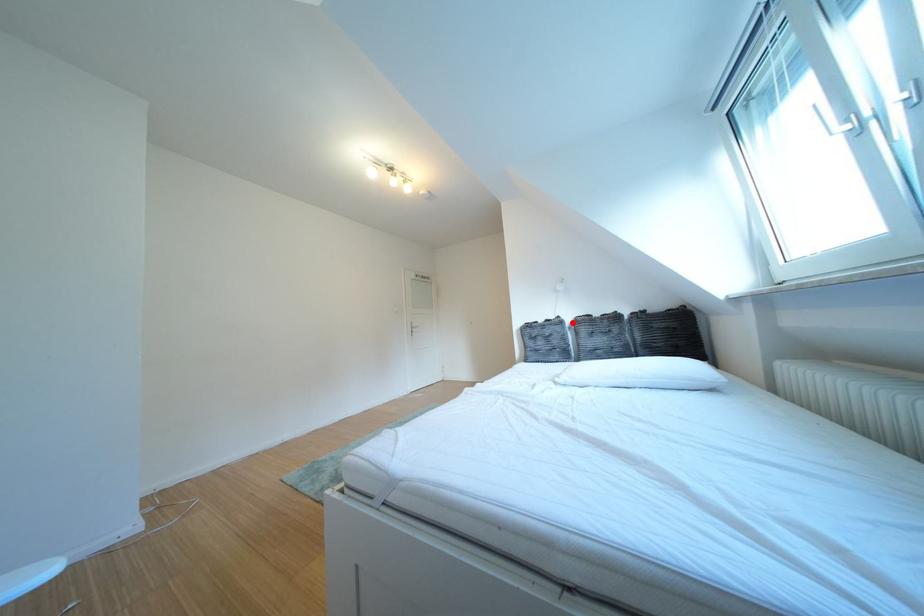
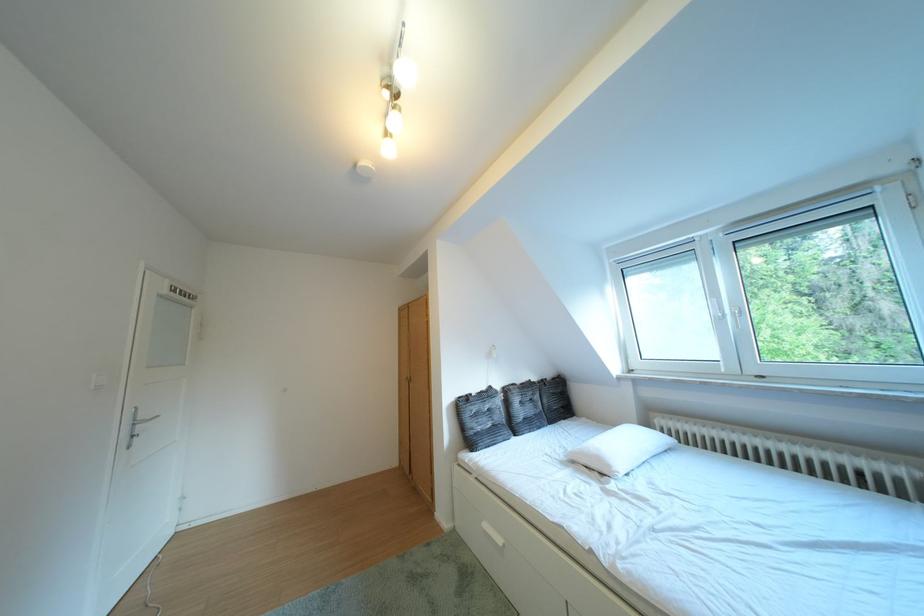
The point at the highlighted location is marked in the first image. Where is the corresponding point in the second image?

(504, 392)